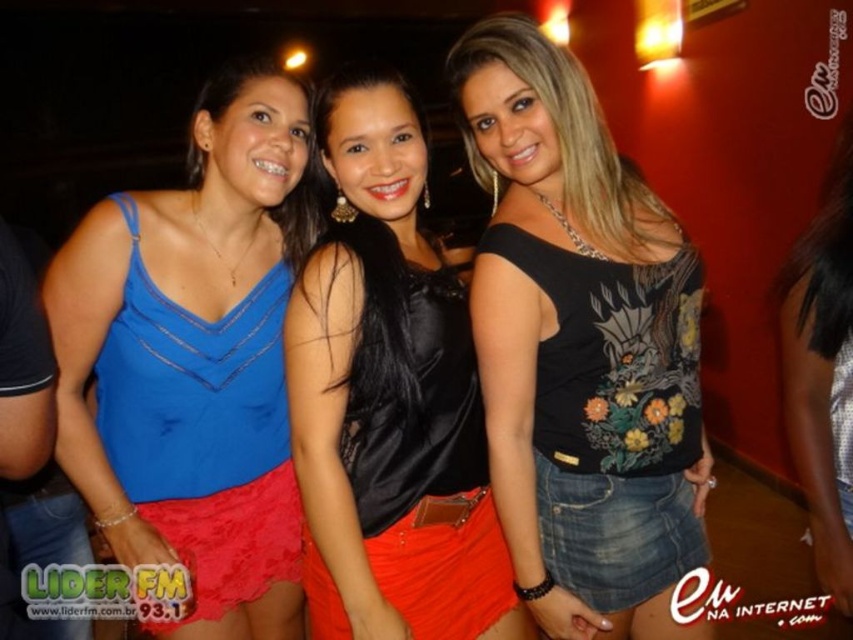
Question: Estimate the real-world distances between objects in this image. Which object is farther from the black floral top at center?

Choices:
 (A) black satin top at center
 (B) blue satin tank top at left
 (C) denim skirt at lower right

Answer: (B)

Question: Does black floral top at center appear on the left side of blue satin tank top at left?

Choices:
 (A) no
 (B) yes

Answer: (A)

Question: Which of the following is the farthest from the observer?

Choices:
 (A) (669, 449)
 (B) (236, 230)
 (C) (817, 236)

Answer: (B)

Question: Is black floral top at center positioned in front of blue satin tank top at left?

Choices:
 (A) no
 (B) yes

Answer: (B)

Question: Which of the following is the farthest from the observer?

Choices:
 (A) (386, 595)
 (B) (547, 500)
 (C) (822, 445)

Answer: (C)

Question: From the image, what is the correct spatial relationship of black floral top at center in relation to denim skirt at lower right?

Choices:
 (A) left
 (B) right

Answer: (A)